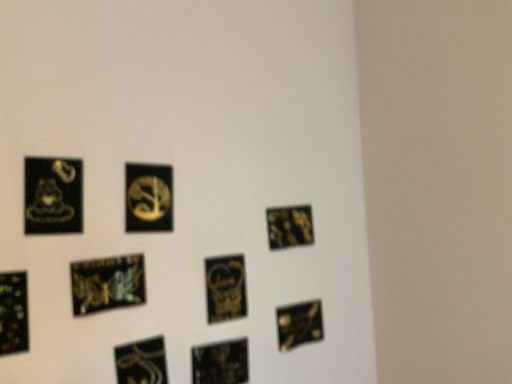
Question: From a real-world perspective, is metallic gold picture frame at center-right, which is the 2th picture frame from right to left, positioned above or below black glossy sticker at lower left, which is the 4th picture frame from left to right?

Choices:
 (A) below
 (B) above

Answer: (B)

Question: From the image's perspective, relative to black glossy sticker at lower left, which is the 4th picture frame from left to right, is metallic gold picture frame at center-right, which is the 2th picture frame from right to left, above or below?

Choices:
 (A) below
 (B) above

Answer: (B)

Question: Based on their relative distances, which object is farther from the gold metallic sign at center, which appears as the 3th picture frame when viewed from the right?

Choices:
 (A) glossy black picture frame at lower left, the third picture frame positioned from the left
 (B) metallic gold picture frame at lower left, the 9th picture frame viewed from the right
 (C) black glossy square at bottom right, arranged as the ninth picture frame when viewed from the left
 (D) metallic gold picture frame at lower center, the 4th picture frame from the right
 (E) matte black coffee cup at left, which is the 8th picture frame in right-to-left order

Answer: (B)

Question: Which object is positioned closest to the metallic gold picture frame at center-right, which is the 2th picture frame from right to left?

Choices:
 (A) black glossy sticker at lower left, which is the 4th picture frame from left to right
 (B) gold metallic sign at center, placed as the fifth picture frame when sorted from left to right
 (C) matte black coffee cup at left, which ranks as the 2th picture frame in left-to-right order
 (D) metallic gold picture frame at lower center, marked as the 6th picture frame in a left-to-right arrangement
 (E) glossy black picture frame at lower left, the third picture frame positioned from the left

Answer: (D)